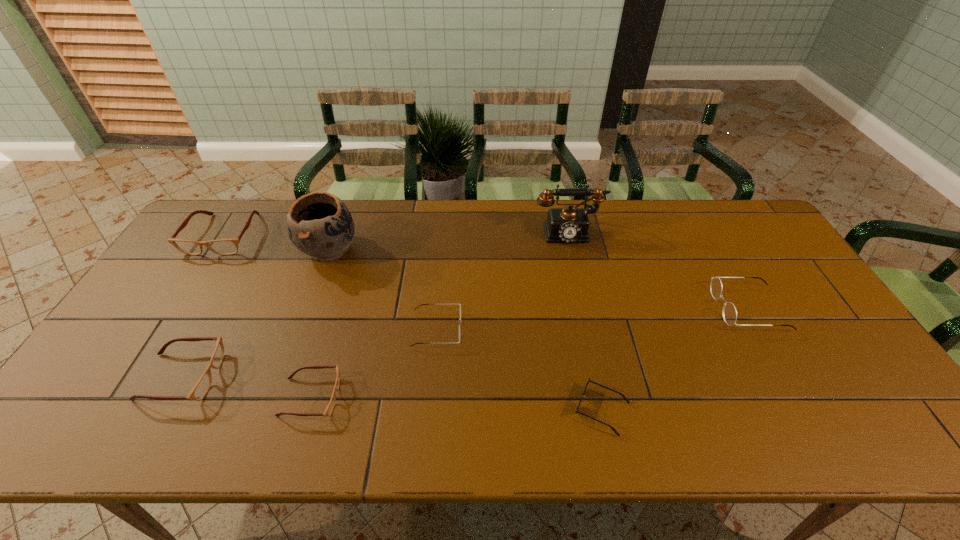
Where is `gray telephone`? gray telephone is located at coordinates (569, 224).

This screenshot has width=960, height=540. I want to click on pottery, so click(319, 224).

Find the location of a particular element. The height and width of the screenshot is (540, 960). the farthest brown spectacles is located at coordinates click(x=223, y=246).

Identify the location of the biggest brown spectacles. [223, 246].

Image resolution: width=960 pixels, height=540 pixels. Find the location of `the right black spectacles`. the right black spectacles is located at coordinates (730, 313).

Identify the location of the bigger black spectacles. This screenshot has height=540, width=960. (730, 313).

The width and height of the screenshot is (960, 540). What are the coordinates of `the second smallest brown spectacles` in the screenshot? It's located at 198,392.

The image size is (960, 540). Find the location of `the fifth object from left to right`. the fifth object from left to right is located at coordinates (422, 304).

The image size is (960, 540). In order to click on the left black spectacles in this screenshot , I will do `click(422, 304)`.

Where is `the shortest spectacles`? This screenshot has width=960, height=540. the shortest spectacles is located at coordinates (329, 409).